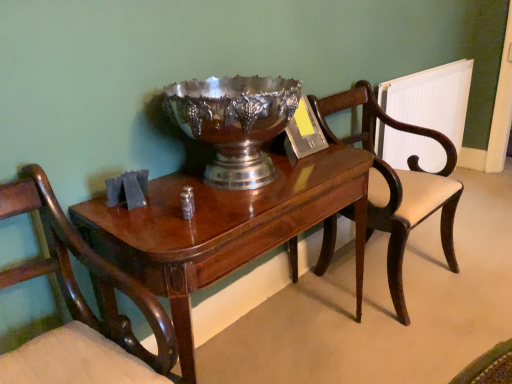
Locate an element on the screen. The image size is (512, 384). vacant space underneath mahogany wood chair at right, marked as the 2th chair in a front-to-back arrangement (from a real-world perspective) is located at coordinates (371, 276).